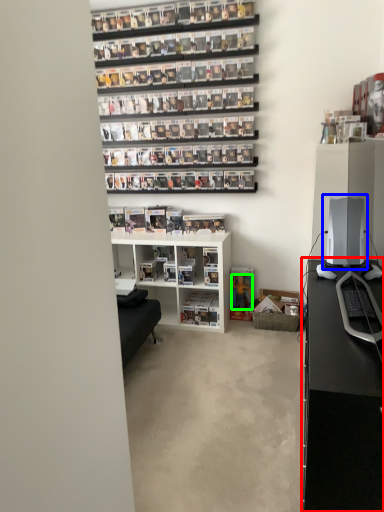
Question: Estimate the real-world distances between objects in this image. Which object is farther from desk (highlighted by a red box), desktop computer (highlighted by a blue box) or toy (highlighted by a green box)?

Choices:
 (A) desktop computer
 (B) toy

Answer: (B)